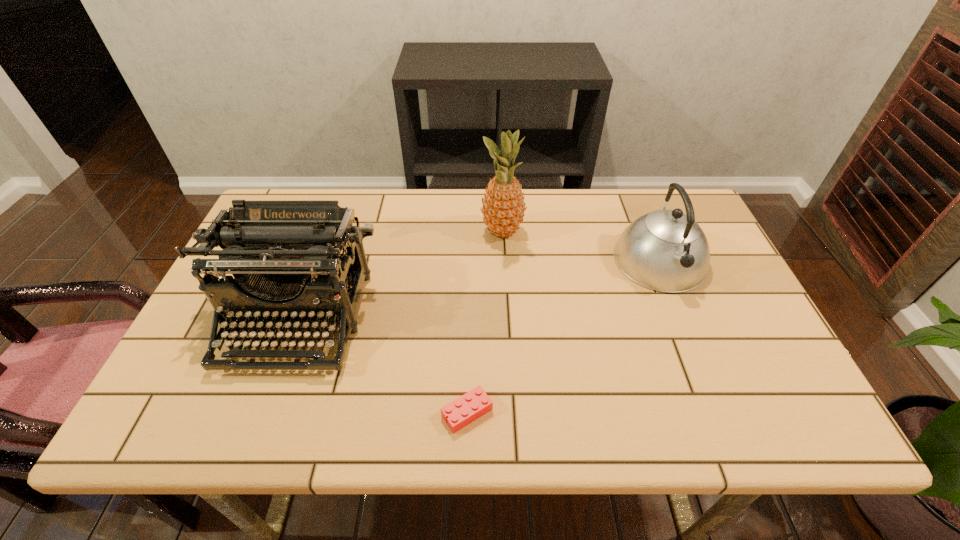
Where is `pineapple`? Image resolution: width=960 pixels, height=540 pixels. pineapple is located at coordinates (503, 208).

Locate an element on the screen. The height and width of the screenshot is (540, 960). typewriter is located at coordinates (283, 255).

At what (x,y) coordinates should I click in order to perform the action: click on kettle. Please return your answer as a coordinate pair (x, y). The height and width of the screenshot is (540, 960). Looking at the image, I should click on (665, 250).

Where is `the nearest object`? The width and height of the screenshot is (960, 540). the nearest object is located at coordinates (467, 408).

Where is `the shortest object`? the shortest object is located at coordinates (467, 408).

Where is `vacant space located 0.090m on the front of the pineapple`? vacant space located 0.090m on the front of the pineapple is located at coordinates (504, 271).

The image size is (960, 540). I want to click on free space located 0.130m on the typing side of the typewriter, so click(x=254, y=434).

Locate an element on the screen. The width and height of the screenshot is (960, 540). vacant space located 0.330m from the spout of the rightmost object is located at coordinates (724, 418).

This screenshot has width=960, height=540. I want to click on vacant space located on the back of the Lego, so click(x=470, y=265).

Locate an element on the screen. pineapple at the far edge is located at coordinates (503, 208).